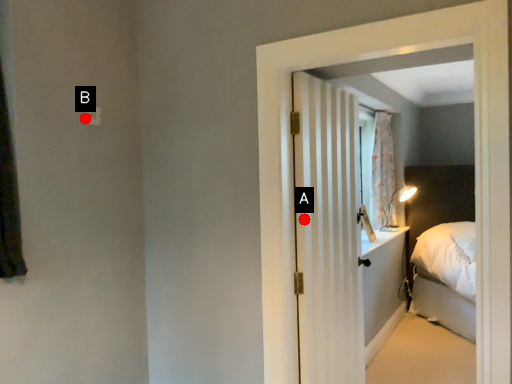
Question: Two points are circled on the image, labeled by A and B beside each circle. Which point is farther from the camera taking this photo?

Choices:
 (A) A is further
 (B) B is further

Answer: (B)